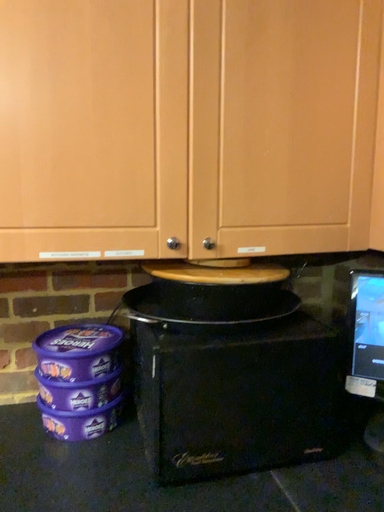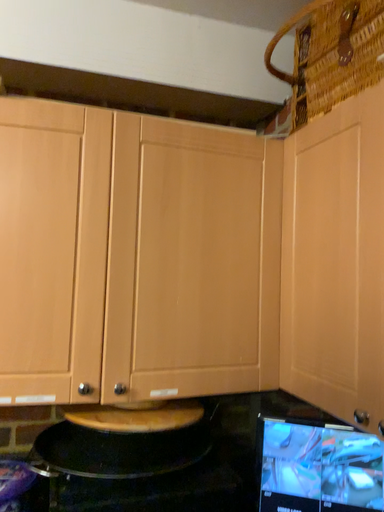
Question: How did the camera likely rotate when shooting the video?

Choices:
 (A) rotated upward
 (B) rotated downward

Answer: (A)